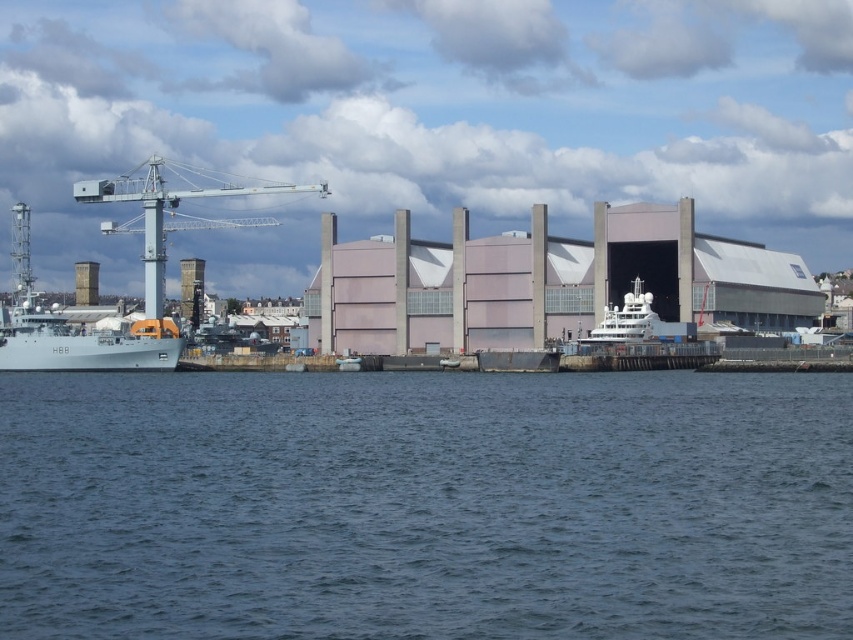
You are standing at the waterfront and want to determine the relative positions of two points marked in the scene. Which point, point (136, 340) or point (158, 205), is closer to you?

Point (136, 340) is closer to the viewer than point (158, 205).

You are a drone operator tasked with capturing aerial footage of the waterfront scene. Your drone is currently hovering at the point specified by the coordinates point (x=425, y=506). Based on the scene description, what primary color would the camera capture at this exact location?

The point (x=425, y=506) indicates blue water at lower center, so the camera would primarily capture the color blue.

You are a harbor worker who needs to move a container from the gray metallic ship at left to the metallic gray crane at upper left. The container truck you are driving has a maximum load capacity of 25 tons. The distance between the two is 22.61 meters. Can you safely transport the container without exceeding the truck capacity?

The distance between the gray metallic ship at left and the metallic gray crane at upper left is 22.61 meters. However, the question about the container truck capacity is unrelated to the distance provided. The truck can safely transport the container as long as its weight does not exceed 25 tons, but the given information does not specify the container weight. Therefore, the distance does not affect the capacity limit.